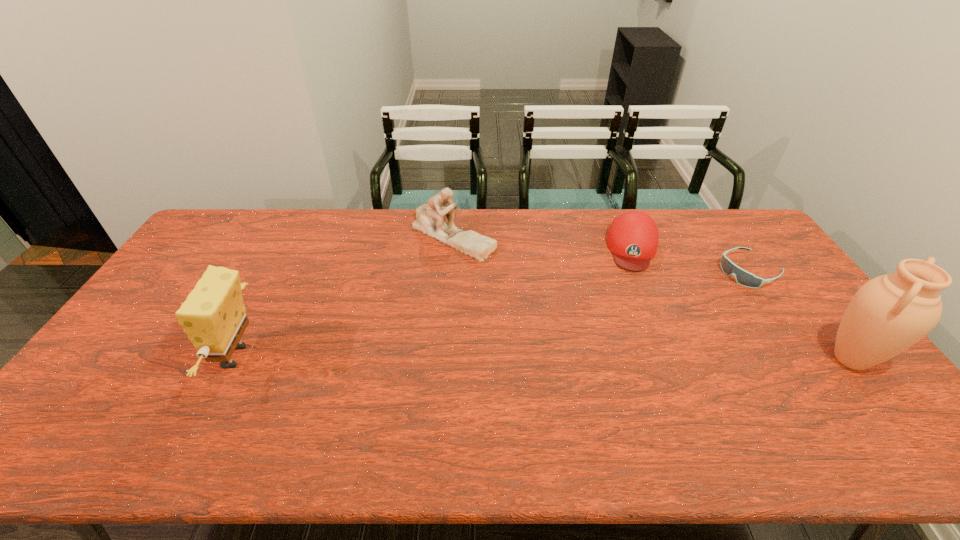
Locate an element on the screen. free space located on the face of the leftmost object is located at coordinates (131, 356).

The image size is (960, 540). In order to click on vacant region located 0.180m on the back of the urn in this screenshot , I will do `click(799, 292)`.

This screenshot has width=960, height=540. What are the coordinates of `free space located on the front-facing side of the figurine` in the screenshot? It's located at (462, 288).

Identify the location of free space located on the front-facing side of the figurine. Image resolution: width=960 pixels, height=540 pixels. (460, 275).

This screenshot has width=960, height=540. I want to click on free space located on the front-facing side of the figurine, so click(x=467, y=321).

At what (x,y) coordinates should I click in order to perform the action: click on vacant space located on the front-facing side of the third object from left to right. Please return your answer as a coordinate pair (x, y). Looking at the image, I should click on (636, 314).

The image size is (960, 540). What are the coordinates of `free space located 0.120m on the front-facing side of the third object from left to right` in the screenshot? It's located at (636, 298).

Identify the location of vacant space located 0.260m on the front-facing side of the third object from left to right. The height and width of the screenshot is (540, 960). (636, 331).

I want to click on free spot located 0.190m on the front-facing side of the goggles, so click(689, 302).

I want to click on vacant space located 0.310m on the front-facing side of the goggles, so click(x=661, y=317).